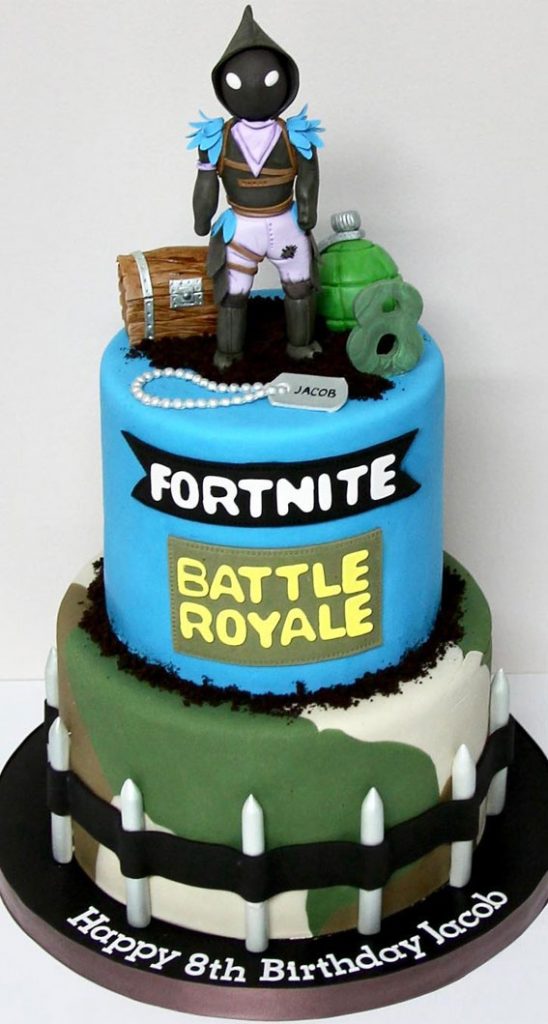
Locate an element on the screen. wall is located at coordinates [366, 89].